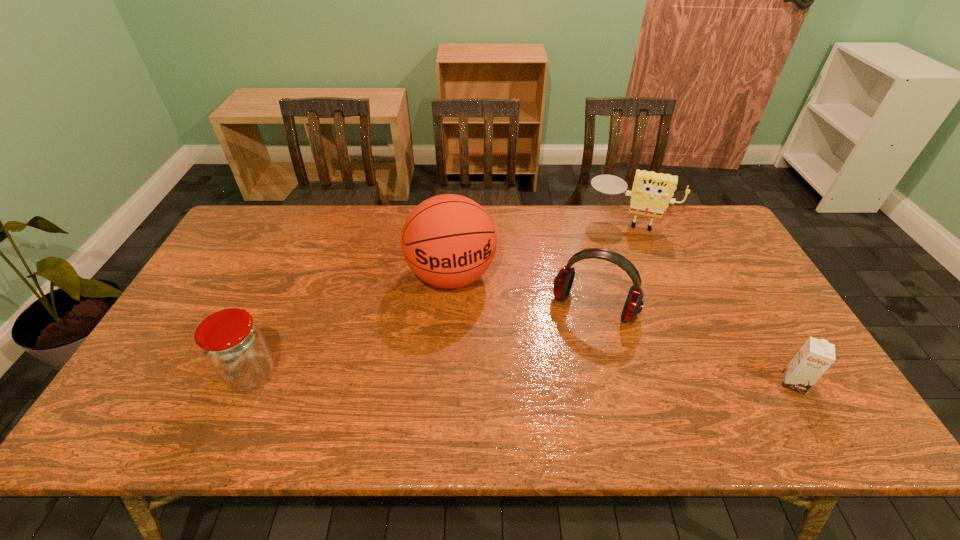
The height and width of the screenshot is (540, 960). Identify the location of free spot between the sponge and the second object from left to right. (540, 247).

Where is `free space between the leftmost object and the basketball`? This screenshot has height=540, width=960. free space between the leftmost object and the basketball is located at coordinates (351, 325).

Locate an element on the screen. The width and height of the screenshot is (960, 540). vacant area between the farthest object and the earphone is located at coordinates (611, 263).

The width and height of the screenshot is (960, 540). I want to click on vacant area between the jar and the tallest object, so click(x=351, y=325).

Find the location of a particular element. The image size is (960, 540). vacant space that is in between the earphone and the jar is located at coordinates (423, 340).

What are the coordinates of `empty location between the farthest object and the fourth object from right to left` in the screenshot? It's located at (540, 247).

Locate an element on the screen. empty location between the farthest object and the basketball is located at coordinates (540, 247).

You are a GUI agent. You are given a task and a screenshot of the screen. Output one action in this format:
    pyautogui.click(x=<x>, y=<y>)
    Task: Click on the free space that is in between the tallest object and the earphone
    
    Given the screenshot: What is the action you would take?
    pyautogui.click(x=523, y=291)

Where is `free spot between the basketball and the shortest object`? Image resolution: width=960 pixels, height=540 pixels. free spot between the basketball and the shortest object is located at coordinates (622, 329).

The width and height of the screenshot is (960, 540). I want to click on the closest object to the fourth object from right to left, so click(563, 281).